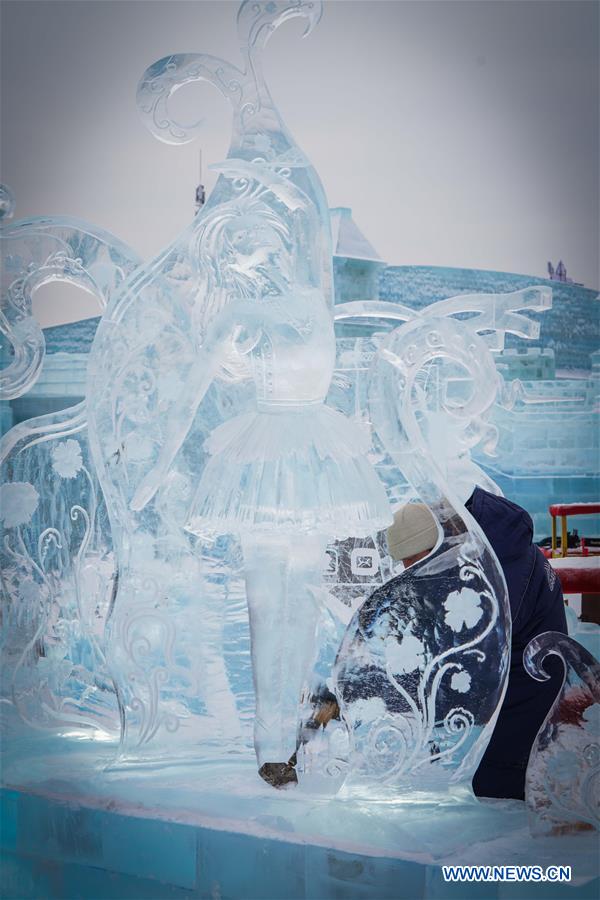
Find the location of `top wall`. top wall is located at coordinates (455, 284).